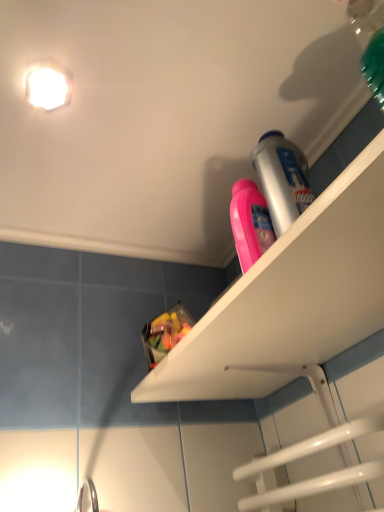
Question: Is translucent plastic bag of candy at upper center taller than white plastic shelf at upper right?

Choices:
 (A) no
 (B) yes

Answer: (A)

Question: From a real-world perspective, is translucent plastic bag of candy at upper center over white plastic shelf at upper right?

Choices:
 (A) no
 (B) yes

Answer: (B)

Question: Would you say translucent plastic bag of candy at upper center is a long distance from white plastic shelf at upper right?

Choices:
 (A) no
 (B) yes

Answer: (A)

Question: Considering the relative sizes of translucent plastic bag of candy at upper center and white plastic shelf at upper right in the image provided, is translucent plastic bag of candy at upper center wider than white plastic shelf at upper right?

Choices:
 (A) yes
 (B) no

Answer: (B)

Question: Is translucent plastic bag of candy at upper center at the right side of white plastic shelf at upper right?

Choices:
 (A) yes
 (B) no

Answer: (B)

Question: Based on their positions, is white glossy light fixture at upper left located to the left or right of white plastic shelf at upper right?

Choices:
 (A) left
 (B) right

Answer: (A)

Question: Considering the positions of white glossy light fixture at upper left and white plastic shelf at upper right in the image, is white glossy light fixture at upper left wider or thinner than white plastic shelf at upper right?

Choices:
 (A) wide
 (B) thin

Answer: (B)

Question: From the image's perspective, relative to white plastic shelf at upper right, is white glossy light fixture at upper left above or below?

Choices:
 (A) above
 (B) below

Answer: (A)

Question: Is point (66, 79) positioned closer to the camera than point (352, 282)?

Choices:
 (A) closer
 (B) farther

Answer: (B)

Question: Would you say white glossy light fixture at upper left is to the left or to the right of translucent plastic bag of candy at upper center in the picture?

Choices:
 (A) left
 (B) right

Answer: (A)

Question: Is white glossy light fixture at upper left taller or shorter than translucent plastic bag of candy at upper center?

Choices:
 (A) tall
 (B) short

Answer: (B)

Question: Considering their positions, is white glossy light fixture at upper left located in front of or behind translucent plastic bag of candy at upper center?

Choices:
 (A) front
 (B) behind

Answer: (A)

Question: From a real-world perspective, is white glossy light fixture at upper left positioned above or below translucent plastic bag of candy at upper center?

Choices:
 (A) above
 (B) below

Answer: (A)

Question: Is translucent plastic bag of candy at upper center bigger or smaller than white glossy light fixture at upper left?

Choices:
 (A) small
 (B) big

Answer: (B)

Question: Based on their positions, is translucent plastic bag of candy at upper center located to the left or right of white glossy light fixture at upper left?

Choices:
 (A) left
 (B) right

Answer: (B)